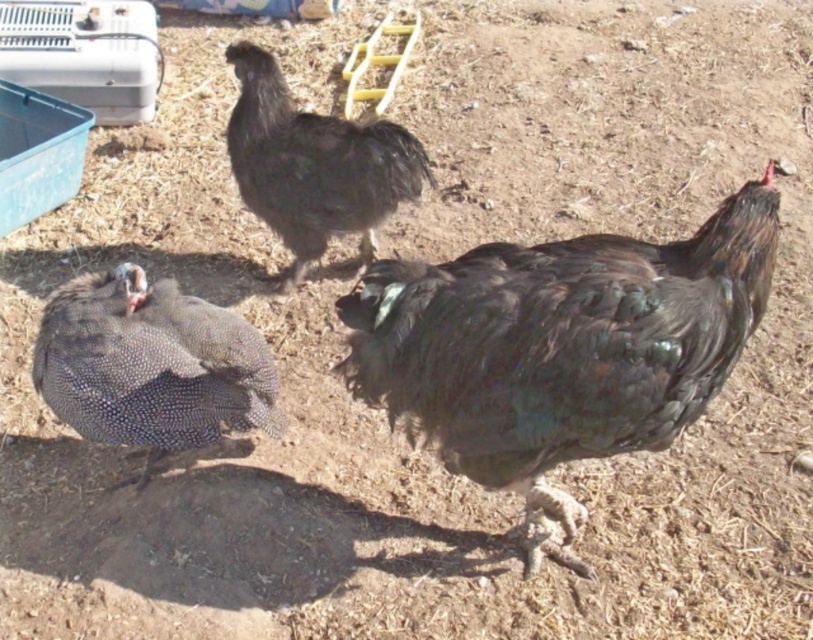
Question: Which of the following is the closest to the observer?

Choices:
 (A) (372, 252)
 (B) (196, 339)
 (C) (481, 461)

Answer: (C)

Question: Is shiny black feathers at center closer to the viewer compared to speckled feathered guinea fowl at lower left?

Choices:
 (A) no
 (B) yes

Answer: (B)

Question: Considering the relative positions of shiny black feathers at center and speckled feathered guinea fowl at lower left in the image provided, where is shiny black feathers at center located with respect to speckled feathered guinea fowl at lower left?

Choices:
 (A) right
 (B) left

Answer: (A)

Question: From the image, what is the correct spatial relationship of shiny black feathers at center in relation to speckled feathered guinea fowl at lower left?

Choices:
 (A) below
 (B) above

Answer: (B)

Question: Estimate the real-world distances between objects in this image. Which object is closer to the speckled feathered guinea fowl at lower left?

Choices:
 (A) shiny black feathers at center
 (B) black feathered chicken at center

Answer: (A)

Question: Which point is closer to the camera taking this photo?

Choices:
 (A) (127, 410)
 (B) (650, 353)

Answer: (B)